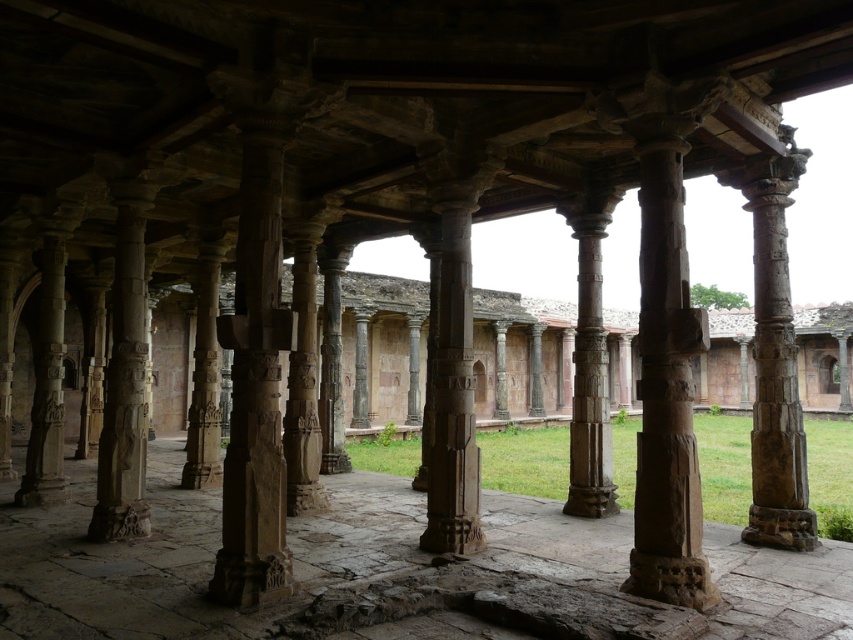
Question: Which point appears closest to the camera in this image?

Choices:
 (A) (277, 218)
 (B) (668, 214)
 (C) (581, 282)

Answer: (B)

Question: Is brown stone column at center closer to camera compared to carved stone column at left?

Choices:
 (A) yes
 (B) no

Answer: (A)

Question: Which point is closer to the camera?

Choices:
 (A) carved stone column at left
 (B) carved stone column at center
 (C) brown stone column at center
 (D) rustic stone column at center

Answer: (D)

Question: Which object is farther from the camera taking this photo?

Choices:
 (A) carved stone column at center
 (B) carved stone pillar at center
 (C) rustic stone column at center

Answer: (A)

Question: Does carved stone column at left appear on the right side of carved stone column at center?

Choices:
 (A) no
 (B) yes

Answer: (A)

Question: Does carved stone pillar at center appear under carved stone column at left?

Choices:
 (A) no
 (B) yes

Answer: (B)